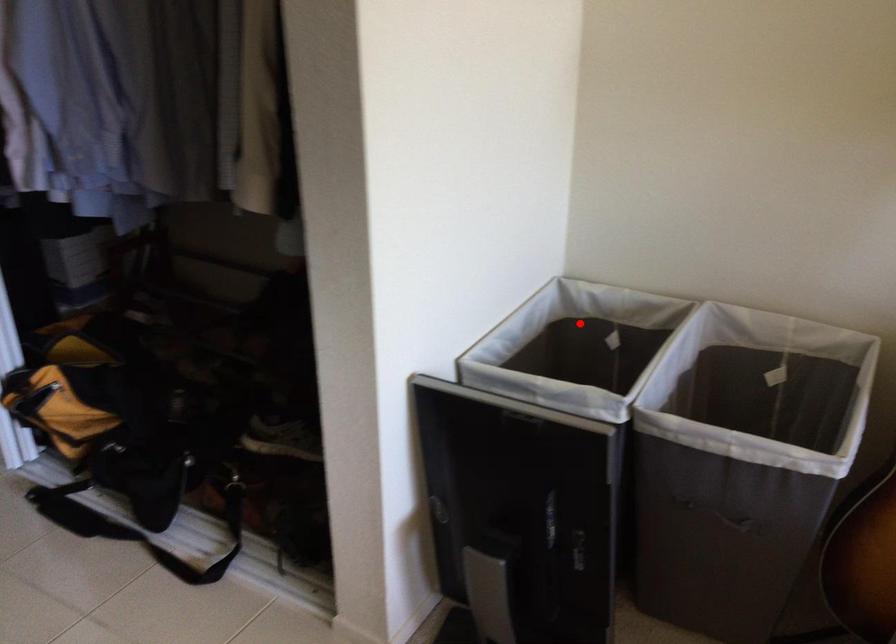
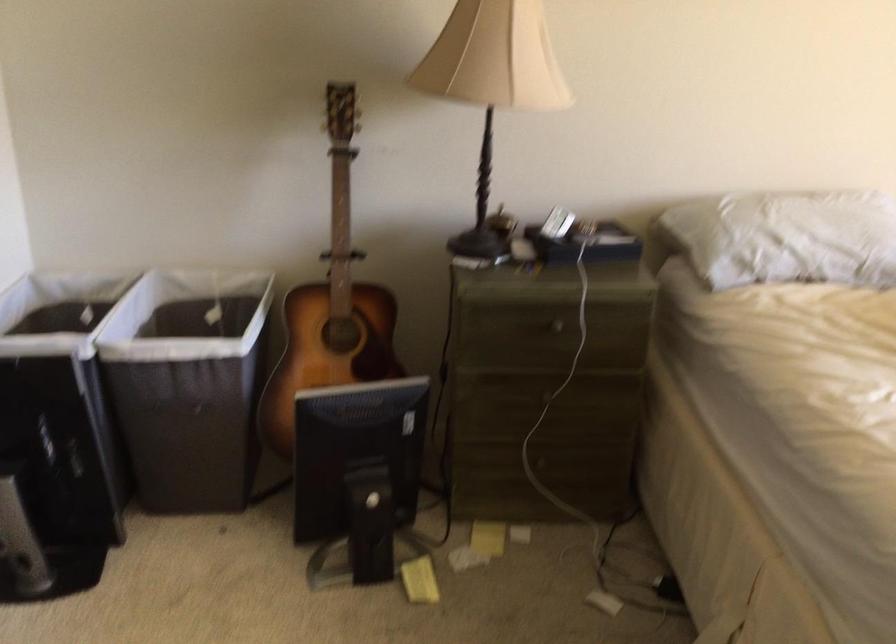
Locate, in the second image, the point that corresponds to the highlighted location in the first image.

(57, 310)